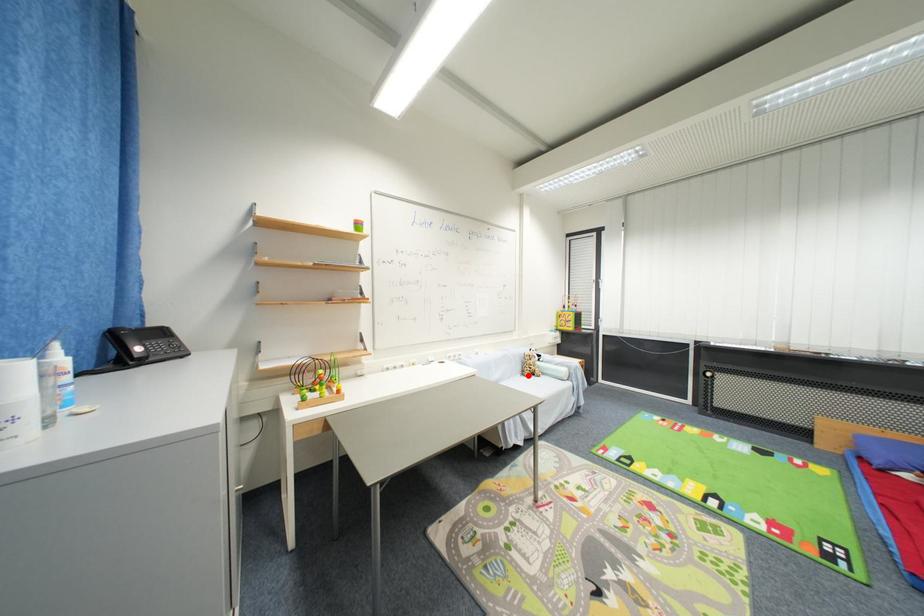
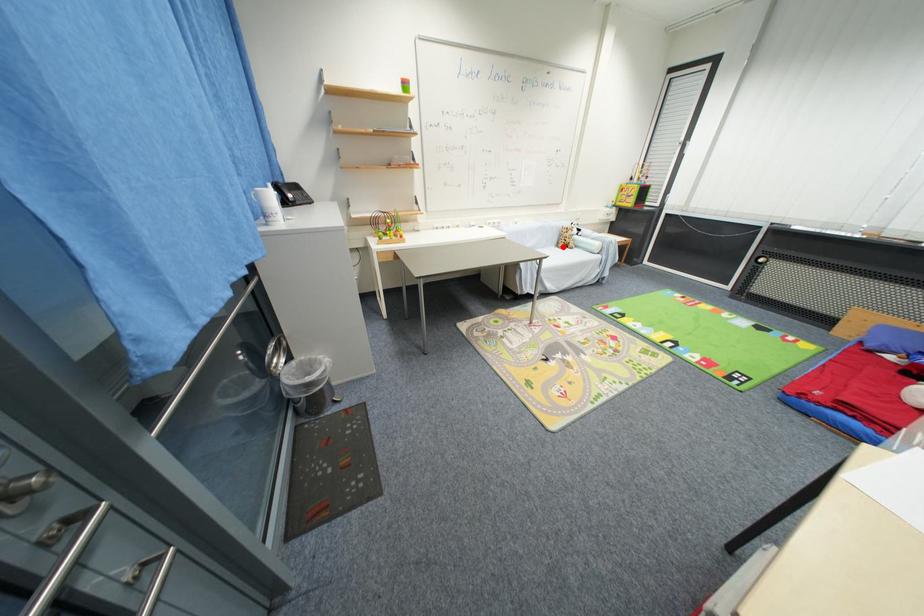
I am providing you with two images of the same scene from different viewpoints. A red point is marked on the first image and another point is marked on the second image. Is the red point in image1 aligned with the point shown in image2?

Yes